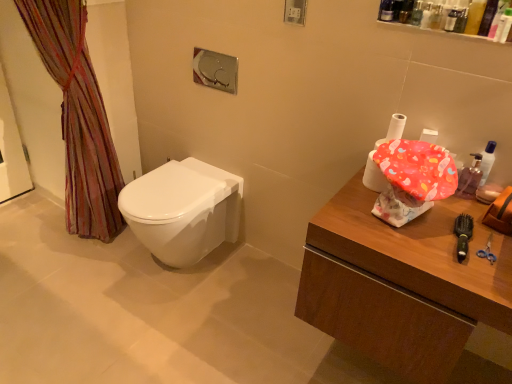
This screenshot has height=384, width=512. In order to click on free space to the left of white glossy toilet at center in this screenshot , I will do pyautogui.click(x=90, y=275).